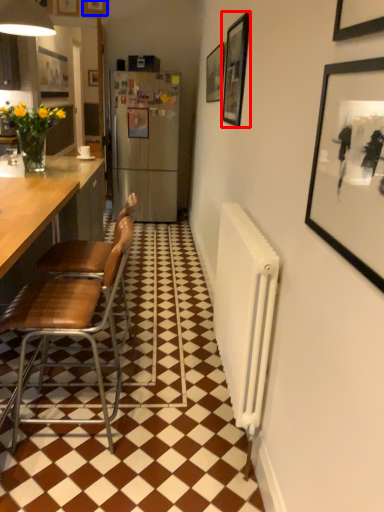
Question: Which of the following is the farthest to the observer, picture frame (highlighted by a red box) or picture frame (highlighted by a blue box)?

Choices:
 (A) picture frame
 (B) picture frame

Answer: (B)